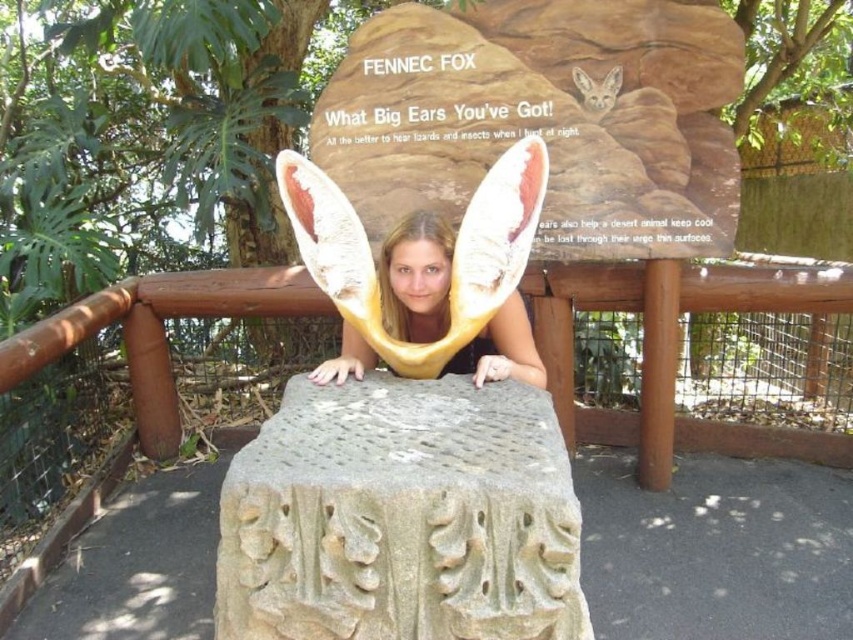
Who is taller, gray rough stone at center or matte yellow ears at center?

With more height is gray rough stone at center.

This screenshot has height=640, width=853. What do you see at coordinates (401, 516) in the screenshot? I see `gray rough stone at center` at bounding box center [401, 516].

Find the location of a particular element. gray rough stone at center is located at coordinates (401, 516).

This screenshot has width=853, height=640. What are the coordinates of `gray rough stone at center` in the screenshot? It's located at (401, 516).

The height and width of the screenshot is (640, 853). What do you see at coordinates (401, 516) in the screenshot?
I see `gray rough stone at center` at bounding box center [401, 516].

Is point (437, 465) closer to viewer compared to point (764, 291)?

Yes.

This screenshot has height=640, width=853. What are the coordinates of `gray rough stone at center` in the screenshot? It's located at (401, 516).

The height and width of the screenshot is (640, 853). In order to click on gray rough stone at center in this screenshot , I will do `click(401, 516)`.

Can you confirm if brown wooden rail at center is taller than matte yellow ears at center?

Yes.

Is brown wooden rail at center positioned at the back of matte yellow ears at center?

Yes, it is.

You are a GUI agent. You are given a task and a screenshot of the screen. Output one action in this format:
    pyautogui.click(x=<x>, y=<y>)
    Task: Click on the brown wooden rail at center
    The height and width of the screenshot is (640, 853).
    Given the screenshot: What is the action you would take?
    pyautogui.click(x=668, y=340)

Locate an element on the screen. Image resolution: width=853 pixels, height=640 pixels. brown wooden rail at center is located at coordinates (668, 340).